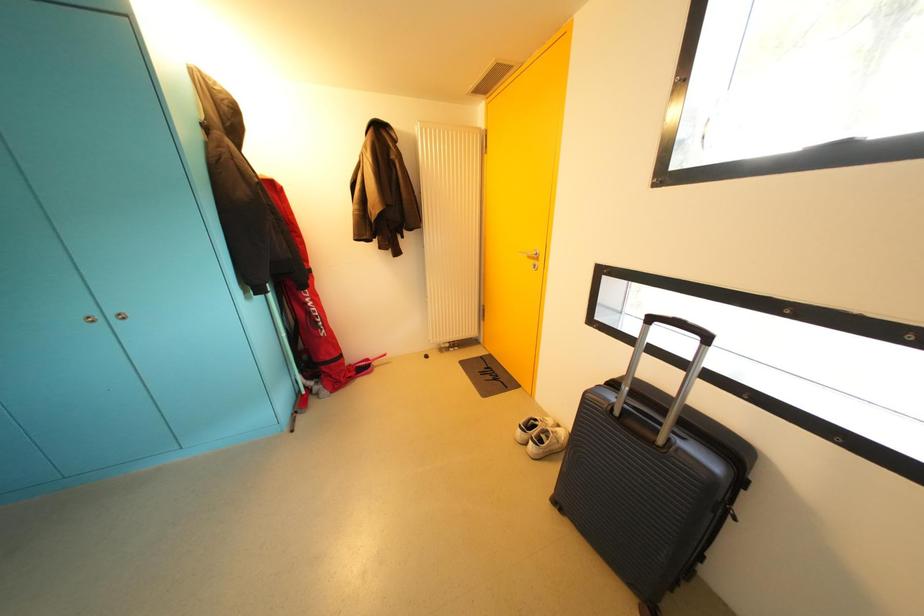
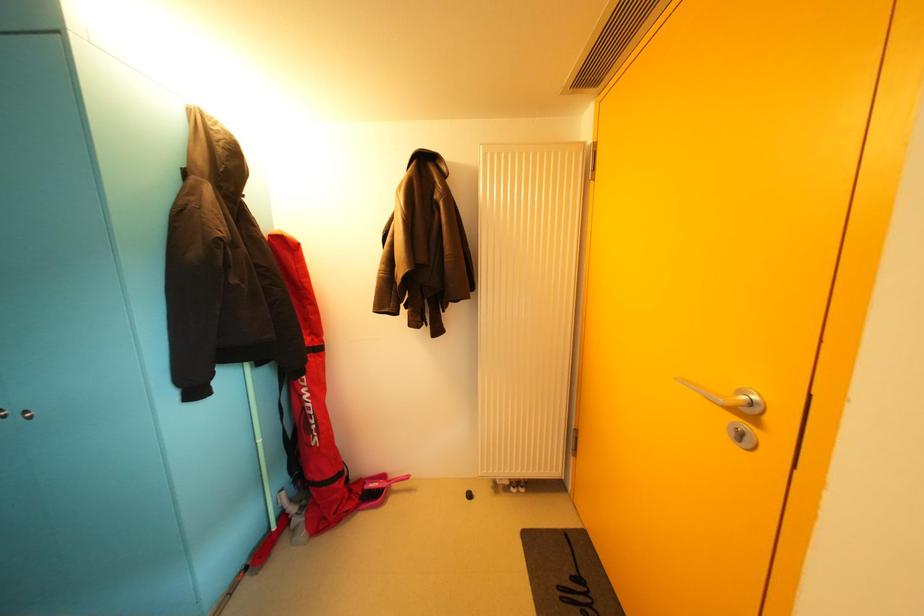
Question: The images are taken continuously from a first-person perspective. In which direction is your viewpoint rotating?

Choices:
 (A) Left
 (B) Right
 (C) Up
 (D) Down

Answer: (A)